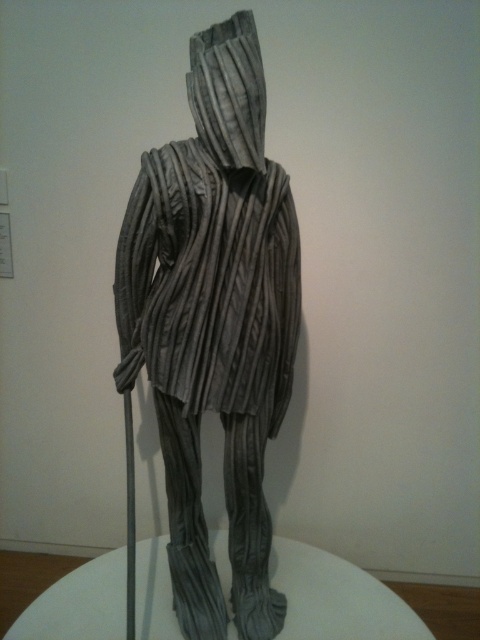
Does gray pleated fabric at center have a lesser height compared to white glossy glass table at center?

No, gray pleated fabric at center is not shorter than white glossy glass table at center.

Who is lower down, gray pleated fabric at center or white glossy glass table at center?

Positioned lower is white glossy glass table at center.

Describe the element at coordinates (215, 321) in the screenshot. The height and width of the screenshot is (640, 480). I see `gray pleated fabric at center` at that location.

Locate an element on the screen. gray pleated fabric at center is located at coordinates (215, 321).

Does white glossy glass table at center have a larger size compared to gray textured fabric hood at center?

Yes, white glossy glass table at center is bigger than gray textured fabric hood at center.

What are the coordinates of `white glossy glass table at center` in the screenshot? It's located at (336, 598).

Is point (76, 625) positioned after point (240, 100)?

Yes, it is.

You are a GUI agent. You are given a task and a screenshot of the screen. Output one action in this format:
    pyautogui.click(x=<x>, y=<y>)
    Task: Click on the white glossy glass table at center
    
    Given the screenshot: What is the action you would take?
    pyautogui.click(x=336, y=598)

Which of these two, gray pleated fabric at center or gray textured fabric hood at center, stands shorter?

gray textured fabric hood at center is shorter.

Between point (269, 289) and point (237, 84), which one is positioned in front?

Point (237, 84) is in front.

From the picture: Who is more forward, (171,244) or (231,156)?

Positioned in front is point (231,156).

You are a GUI agent. You are given a task and a screenshot of the screen. Output one action in this format:
    pyautogui.click(x=<x>, y=<y>)
    Task: Click on the gray pleated fabric at center
    
    Given the screenshot: What is the action you would take?
    click(x=215, y=321)